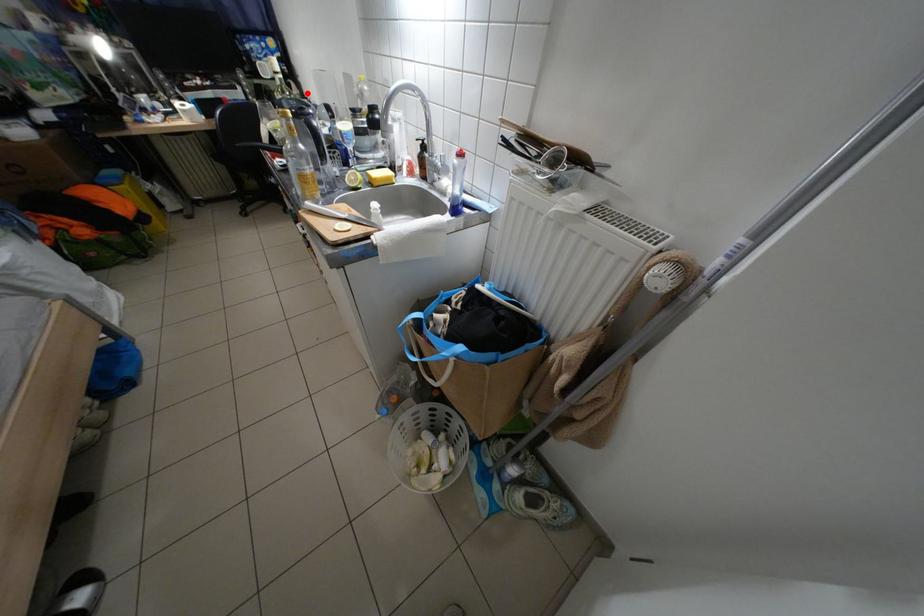
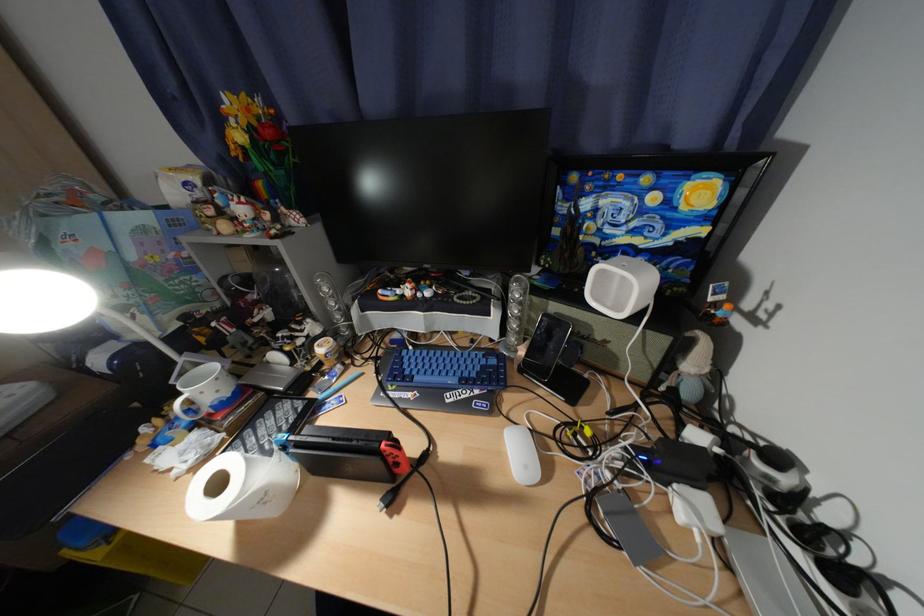
Question: I am providing you with two images of the same scene from different viewpoints. Given a red point in image1, look at the same physical point in image2. Is it:

Choices:
 (A) Closer to the viewpoint
 (B) Farther from the viewpoint

Answer: (A)